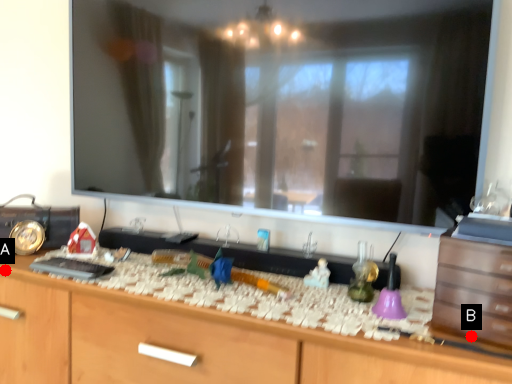
Question: Two points are circled on the image, labeled by A and B beside each circle. Which of the following is the closest to the observer?

Choices:
 (A) A is closer
 (B) B is closer

Answer: (B)